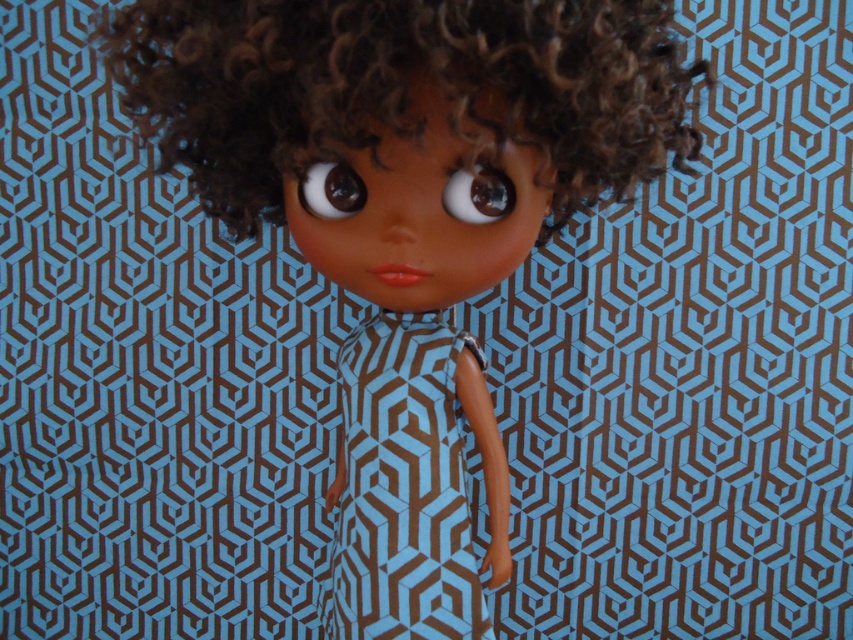
Is matte plastic doll at center shorter than blue geometric-patterned dress at center?

In fact, matte plastic doll at center may be taller than blue geometric-patterned dress at center.

In the scene shown: Between matte plastic doll at center and blue geometric-patterned dress at center, which one has more height?

Standing taller between the two is matte plastic doll at center.

Find the location of a particular element. matte plastic doll at center is located at coordinates (405, 120).

Does point (573, 116) come farther from viewer compared to point (300, 102)?

Yes, point (573, 116) is behind point (300, 102).

In the scene shown: Does matte plastic doll at center appear under brown curly hair at center?

Correct, matte plastic doll at center is located below brown curly hair at center.

This screenshot has height=640, width=853. Describe the element at coordinates (405, 120) in the screenshot. I see `matte plastic doll at center` at that location.

Where is `matte plastic doll at center`? Image resolution: width=853 pixels, height=640 pixels. matte plastic doll at center is located at coordinates (405, 120).

Who is more distant from viewer, (427, 310) or (473, 204)?

Positioned behind is point (427, 310).

Who is higher up, matte plastic doll at center or brown glossy eye at center?

brown glossy eye at center

Locate an element on the screen. The width and height of the screenshot is (853, 640). matte plastic doll at center is located at coordinates [x=405, y=120].

Find the location of a particular element. matte plastic doll at center is located at coordinates (405, 120).